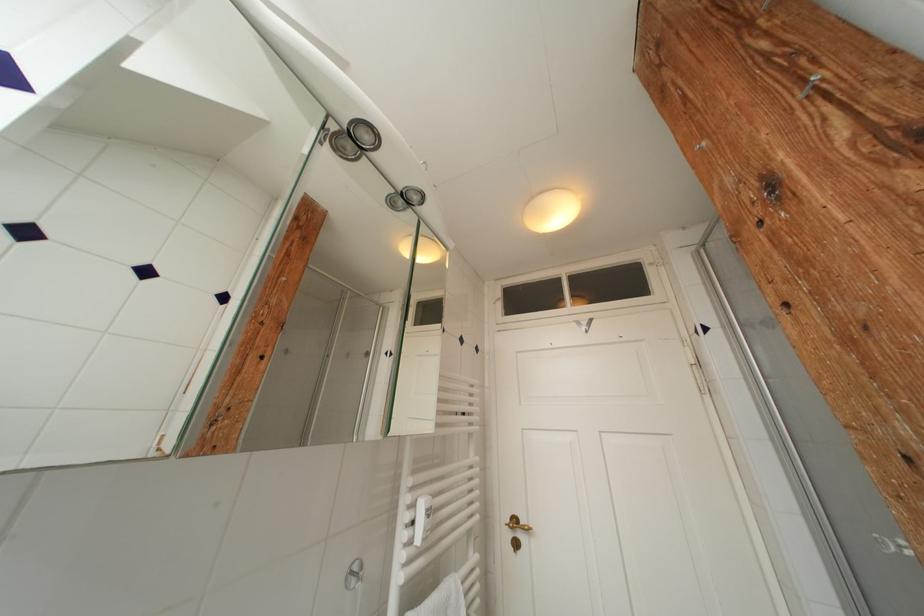
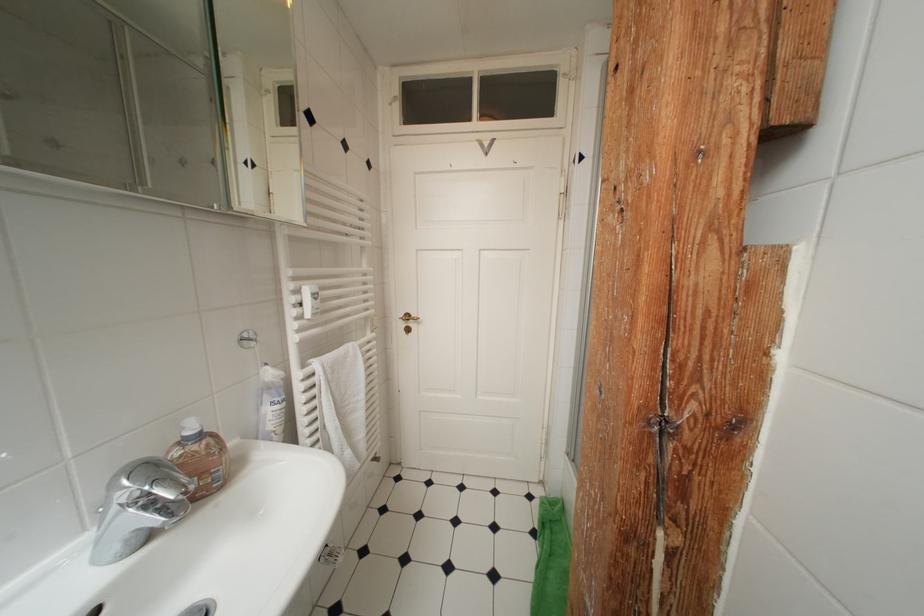
Locate, in the second image, the point that corresponds to point (419, 511) in the first image.

(304, 294)